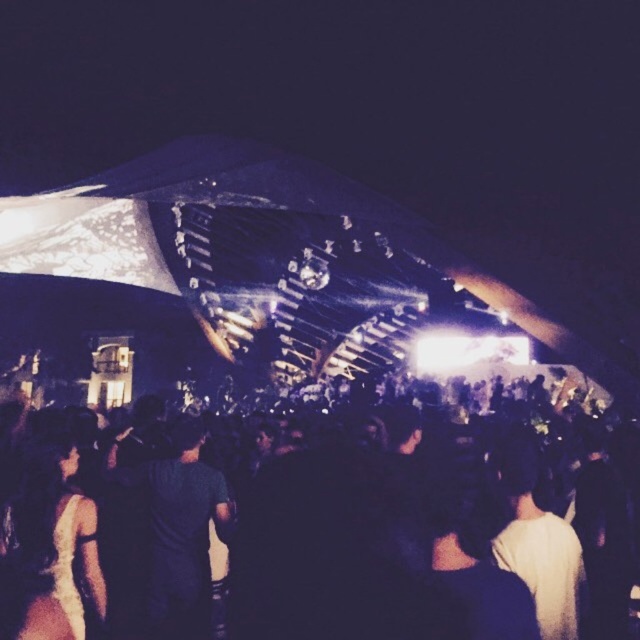
Does dark gray shirt at center lie behind white matte dress at lower left?

Yes, dark gray shirt at center is behind white matte dress at lower left.

Does dark gray shirt at center have a greater width compared to white matte dress at lower left?

Correct, the width of dark gray shirt at center exceeds that of white matte dress at lower left.

I want to click on dark gray shirt at center, so click(x=177, y=529).

Locate an element on the screen. The image size is (640, 640). dark gray shirt at center is located at coordinates (177, 529).

Is black matte crowd at center bigger than white matte dress at lower left?

Indeed, black matte crowd at center has a larger size compared to white matte dress at lower left.

Is black matte crowd at center to the left of white matte dress at lower left from the viewer's perspective?

In fact, black matte crowd at center is to the right of white matte dress at lower left.

Measure the distance between point (276, 572) and camera.

The distance of point (276, 572) from camera is 76.21 meters.

The width and height of the screenshot is (640, 640). In order to click on black matte crowd at center in this screenshot , I will do `click(269, 536)`.

Which is more to the left, black matte crowd at center or dark gray shirt at center?

From the viewer's perspective, dark gray shirt at center appears more on the left side.

Does black matte crowd at center appear over dark gray shirt at center?

Yes.

What are the coordinates of `black matte crowd at center` in the screenshot? It's located at 269,536.

Identify the location of black matte crowd at center. This screenshot has height=640, width=640. (269, 536).